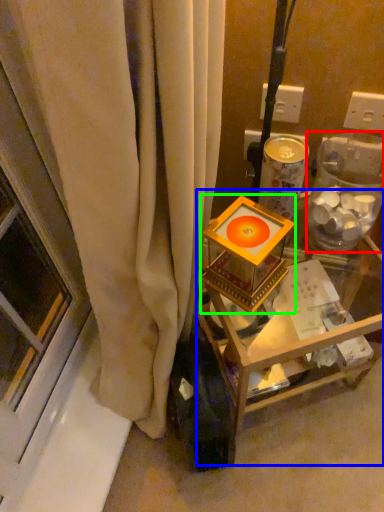
Question: Estimate the real-world distances between objects in this image. Which object is farther from glass box (highlighted by a red box), furniture (highlighted by a blue box) or candle holder (highlighted by a green box)?

Choices:
 (A) furniture
 (B) candle holder

Answer: (A)